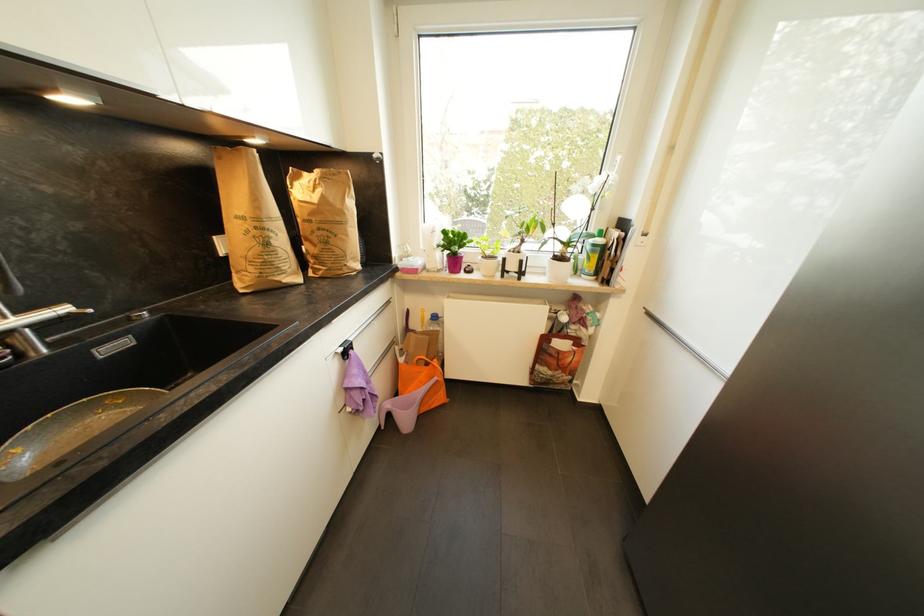
Locate an element on the screen. window blind bar is located at coordinates (392, 17).